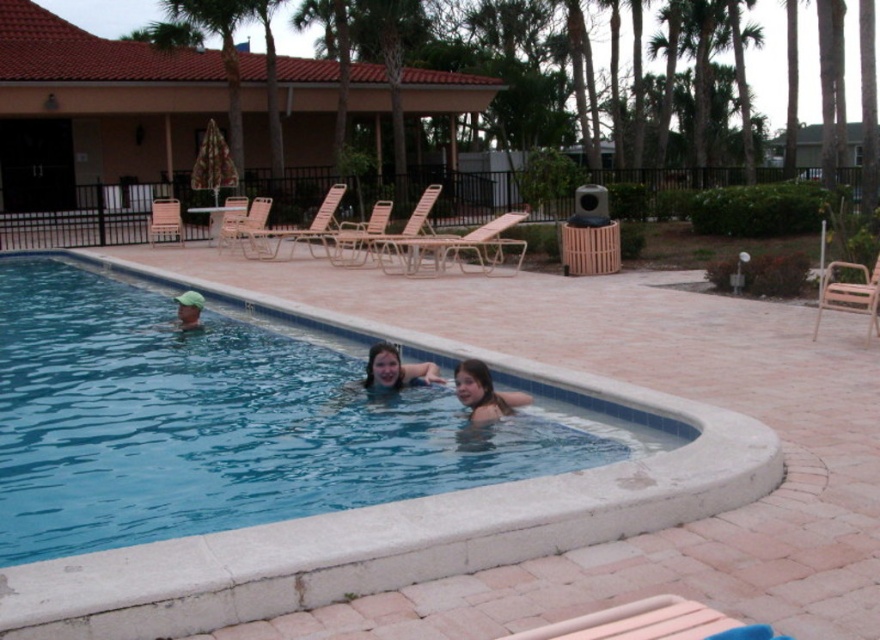
You are standing at the center of the pool area and want to locate the smooth skin girl at center. According to the coordinates provided, in which direction should you look to find her?

The smooth skin girl at center is located at coordinates point (484, 392). Since the center of the pool area is at point (440, 320), you should look towards the northeast direction to find her.

You are a photographer standing at the edge of the pool. You want to take a photo of the smooth skin face at center and the matte green cap at left. Which object will appear larger in your photo?

The smooth skin face at center will appear larger in the photo because it is closer to the viewer than the matte green cap at left.

In the scene shown: You are a lifeguard standing at the edge of the pool. You notice the blue smooth water at center and the smooth skin girl at center. How far apart are these two from each other?

The blue smooth water at center and the smooth skin girl at center are 1.28 meters apart from each other.